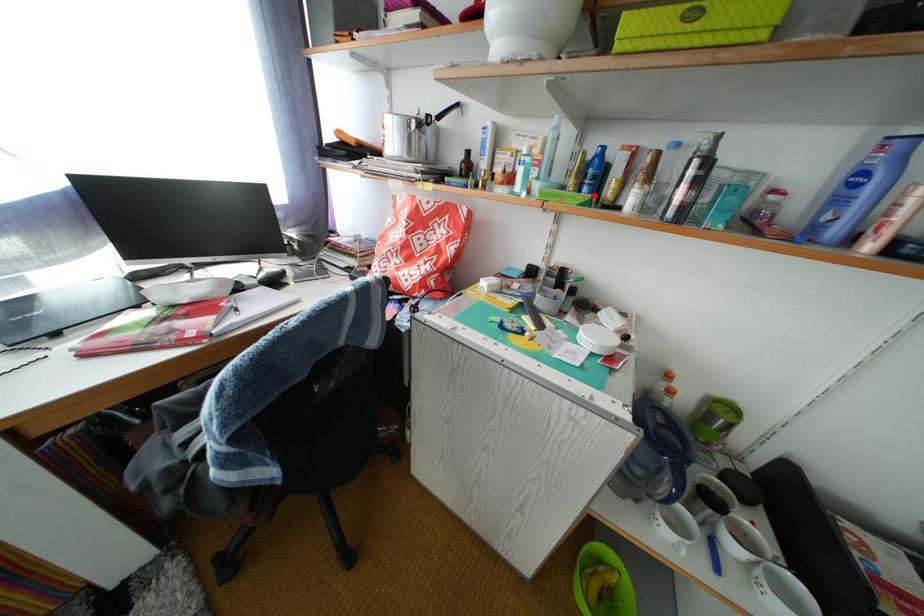
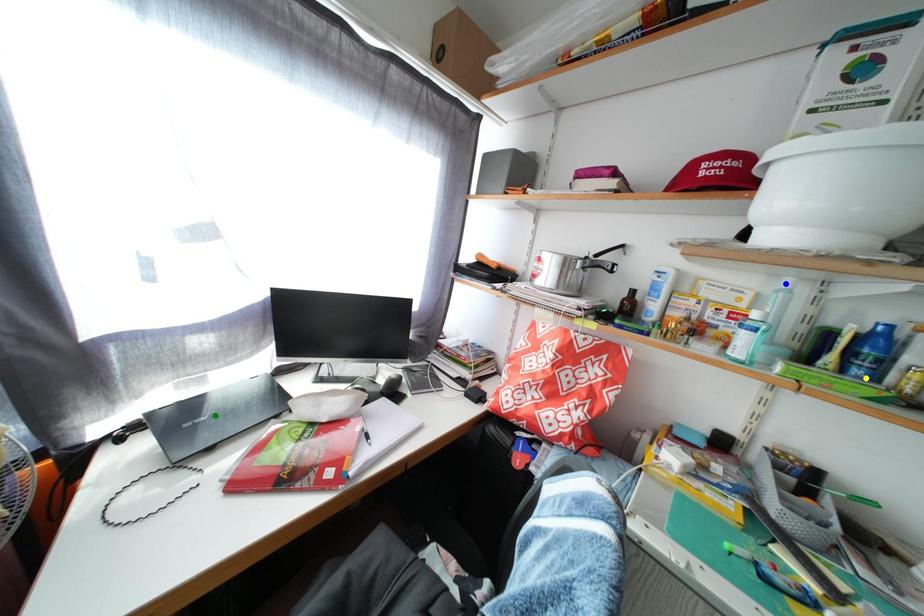
Question: I am providing you with two images of the same scene from different viewpoints. A red point is marked on the first image. You are given multiple points on the second image. Which mark in image 2 goes with the point in image 1?

Choices:
 (A) yellow point
 (B) green point
 (C) blue point

Answer: (A)